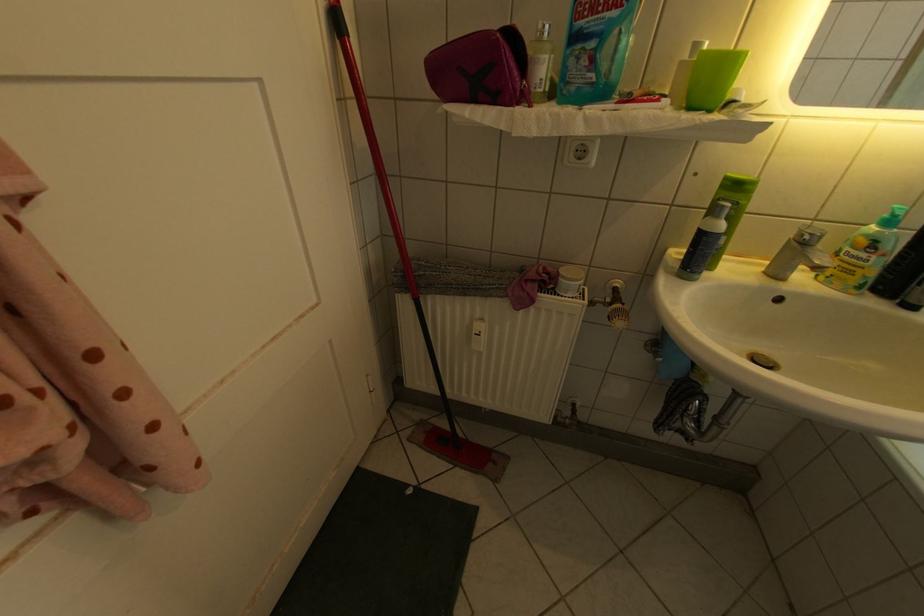
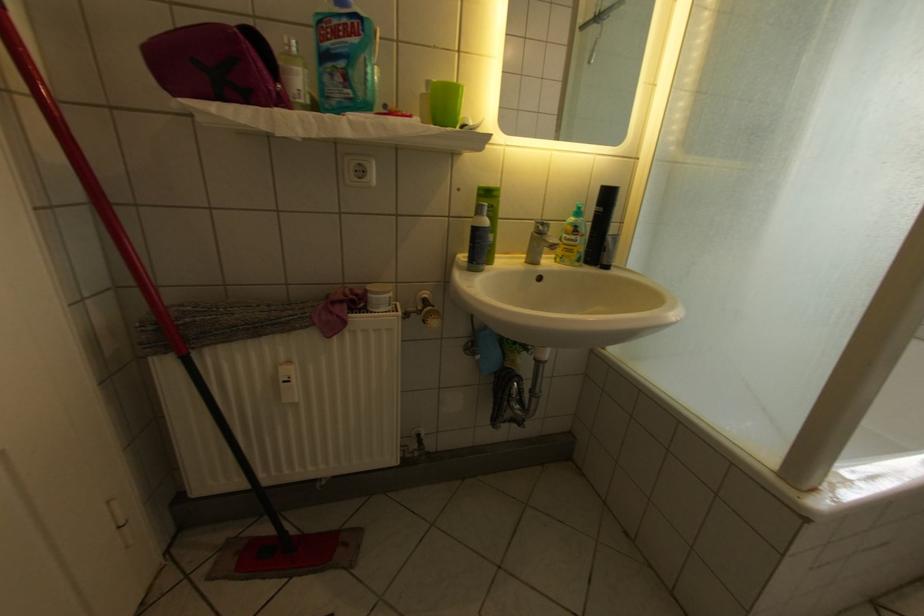
Where in the second image is the point corresponding to (x=604, y=78) from the first image?

(360, 92)